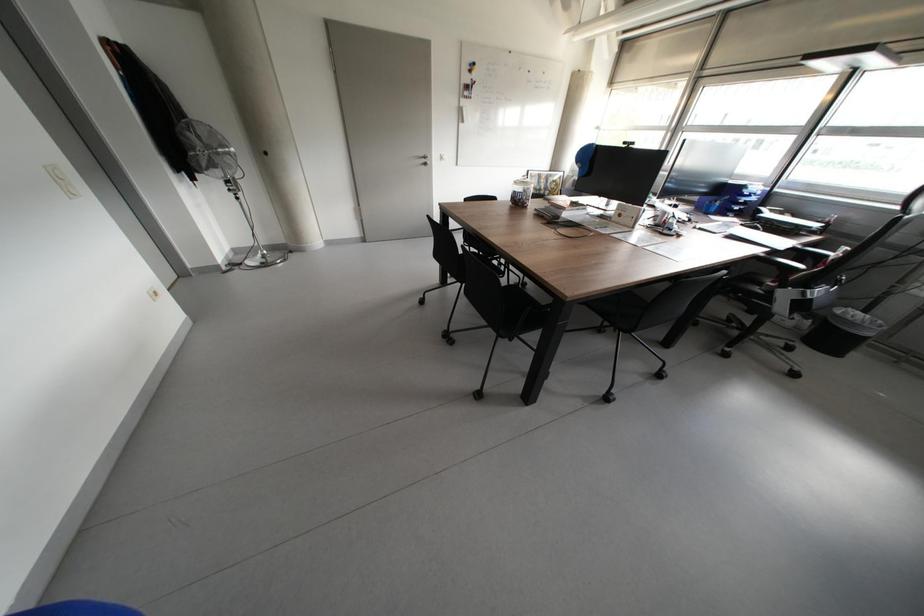
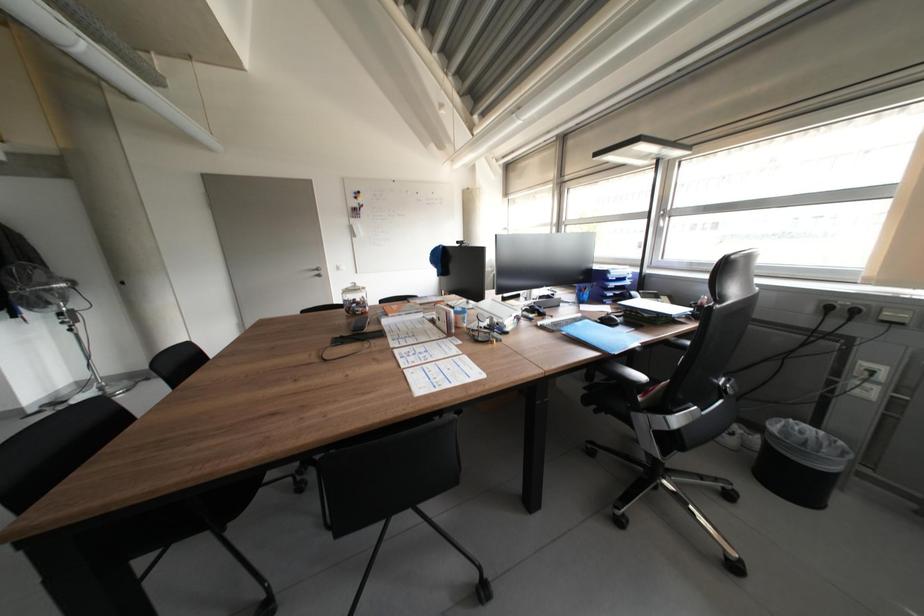
Question: What movement of the cameraman would produce the second image?

Choices:
 (A) Left
 (B) Right
 (C) Forward
 (D) Backward

Answer: (B)